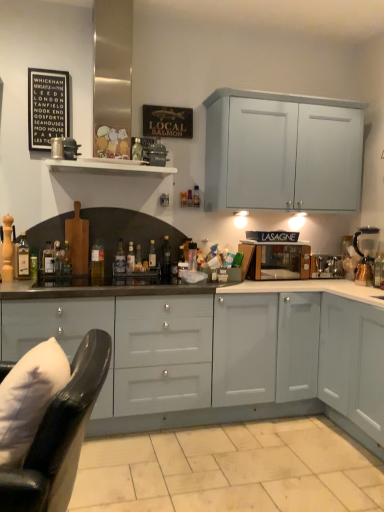
Question: Which direction should I rotate to look at translucent glass bottle at center, which is counted as the second bottle, starting from the right?

Choices:
 (A) left
 (B) right

Answer: (A)

Question: Is translucent glass bottle at center, arranged as the 8th bottle when viewed from the left, bigger than black glass bottle at center, positioned as the 1th bottle in right-to-left order?

Choices:
 (A) yes
 (B) no

Answer: (B)

Question: Is translucent glass bottle at center, which ranks as the 4th bottle in right-to-left order, facing away from black glass bottle at center, which appears as the 11th bottle when viewed from the left?

Choices:
 (A) yes
 (B) no

Answer: (B)

Question: From the image's perspective, is translucent glass bottle at center, which ranks as the 4th bottle in right-to-left order, located beneath black glass bottle at center, positioned as the 1th bottle in right-to-left order?

Choices:
 (A) no
 (B) yes

Answer: (B)

Question: From a real-world perspective, is translucent glass bottle at center, which ranks as the 4th bottle in right-to-left order, on black glass bottle at center, positioned as the 1th bottle in right-to-left order?

Choices:
 (A) yes
 (B) no

Answer: (B)

Question: Does translucent glass bottle at center, which ranks as the 4th bottle in right-to-left order, come behind black glass bottle at center, which appears as the 11th bottle when viewed from the left?

Choices:
 (A) yes
 (B) no

Answer: (B)

Question: Could black glass bottle at center, positioned as the 1th bottle in right-to-left order, be considered to be inside translucent glass bottle at center, arranged as the 8th bottle when viewed from the left?

Choices:
 (A) no
 (B) yes

Answer: (A)

Question: From the image's perspective, is black glass bottle at center, positioned as the 1th bottle in right-to-left order, located above white soft pillow at lower left?

Choices:
 (A) yes
 (B) no

Answer: (A)

Question: Is black glass bottle at center, positioned as the 1th bottle in right-to-left order, far from white soft pillow at lower left?

Choices:
 (A) yes
 (B) no

Answer: (A)

Question: Is black glass bottle at center, which appears as the 11th bottle when viewed from the left, closer to the viewer compared to white soft pillow at lower left?

Choices:
 (A) yes
 (B) no

Answer: (B)

Question: Is black glass bottle at center, positioned as the 1th bottle in right-to-left order, further to camera compared to white soft pillow at lower left?

Choices:
 (A) no
 (B) yes

Answer: (B)

Question: From a real-world perspective, is black glass bottle at center, which appears as the 11th bottle when viewed from the left, over white soft pillow at lower left?

Choices:
 (A) yes
 (B) no

Answer: (A)

Question: Is black glass bottle at center, positioned as the 1th bottle in right-to-left order, oriented towards white soft pillow at lower left?

Choices:
 (A) no
 (B) yes

Answer: (A)

Question: Is translucent glass bottle at center, which is the 8th bottle from right to left, positioned in front of black paper at upper left?

Choices:
 (A) yes
 (B) no

Answer: (B)